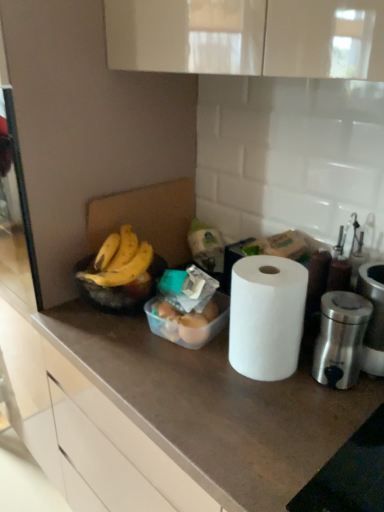
Question: Should I look upward or downward to see black plastic bowl at left?

Choices:
 (A) down
 (B) up

Answer: (A)

Question: Is translucent plastic eggs at center further to camera compared to white matte countertop at center?

Choices:
 (A) yes
 (B) no

Answer: (A)

Question: Does translucent plastic eggs at center turn towards white matte countertop at center?

Choices:
 (A) yes
 (B) no

Answer: (B)

Question: From a real-world perspective, is translucent plastic eggs at center beneath white matte countertop at center?

Choices:
 (A) yes
 (B) no

Answer: (B)

Question: Is translucent plastic eggs at center placed right next to white matte countertop at center?

Choices:
 (A) yes
 (B) no

Answer: (B)

Question: From the image's perspective, is translucent plastic eggs at center above white matte countertop at center?

Choices:
 (A) yes
 (B) no

Answer: (A)

Question: Does translucent plastic eggs at center appear on the left side of white matte countertop at center?

Choices:
 (A) yes
 (B) no

Answer: (A)

Question: Is translucent plastic eggs at center wider than polished stainless steel appliance at right?

Choices:
 (A) no
 (B) yes

Answer: (B)

Question: From a real-world perspective, is translucent plastic eggs at center located higher than polished stainless steel appliance at right?

Choices:
 (A) yes
 (B) no

Answer: (B)

Question: Is translucent plastic eggs at center looking in the opposite direction of polished stainless steel appliance at right?

Choices:
 (A) yes
 (B) no

Answer: (B)

Question: From the image's perspective, would you say translucent plastic eggs at center is shown under polished stainless steel appliance at right?

Choices:
 (A) yes
 (B) no

Answer: (B)

Question: Is translucent plastic eggs at center thinner than polished stainless steel appliance at right?

Choices:
 (A) no
 (B) yes

Answer: (A)

Question: Can you confirm if translucent plastic eggs at center is positioned to the right of polished stainless steel appliance at right?

Choices:
 (A) yes
 (B) no

Answer: (B)

Question: Can you confirm if white matte paper towel at center is thinner than translucent plastic eggs at center?

Choices:
 (A) no
 (B) yes

Answer: (B)